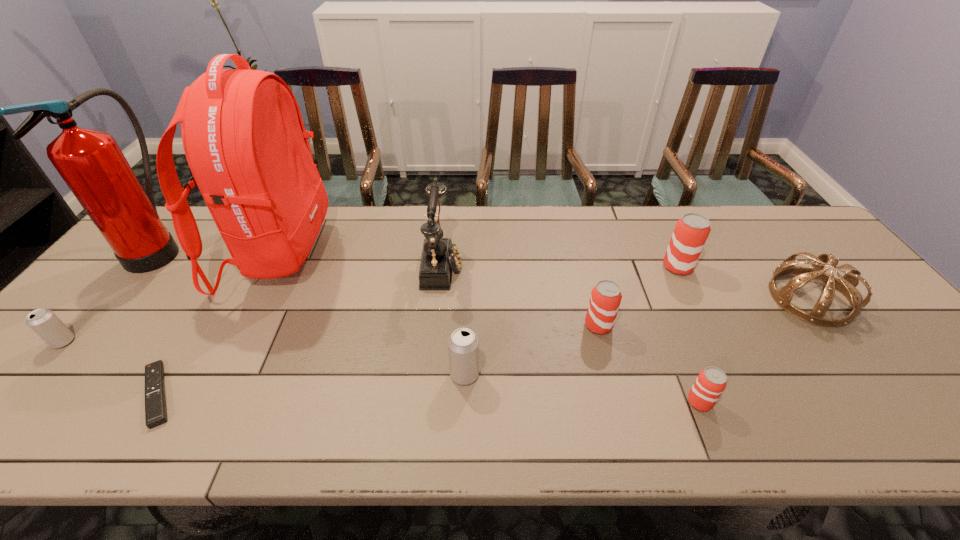
The width and height of the screenshot is (960, 540). Identify the location of the second nearest beer can. (463, 344).

The width and height of the screenshot is (960, 540). I want to click on the second beer can from left to right, so click(x=463, y=344).

Find the location of a particular element. This screenshot has width=960, height=540. the left white beer can is located at coordinates (44, 322).

Where is `the leftmost beer can`? This screenshot has width=960, height=540. the leftmost beer can is located at coordinates (44, 322).

Identify the location of the fourth beer can from left to right. Image resolution: width=960 pixels, height=540 pixels. (711, 382).

The height and width of the screenshot is (540, 960). I want to click on the nearest orange beer can, so click(x=711, y=382).

The width and height of the screenshot is (960, 540). Identify the location of remote control. (155, 403).

Image resolution: width=960 pixels, height=540 pixels. In order to click on vacant point located on the main compartment of the red backpack in this screenshot , I will do `click(373, 254)`.

Where is `vacant region located on the right of the red fire extinguisher`? Image resolution: width=960 pixels, height=540 pixels. vacant region located on the right of the red fire extinguisher is located at coordinates (286, 248).

Identify the location of vacant space positioned 0.070m on the dial of the black telephone. (486, 265).